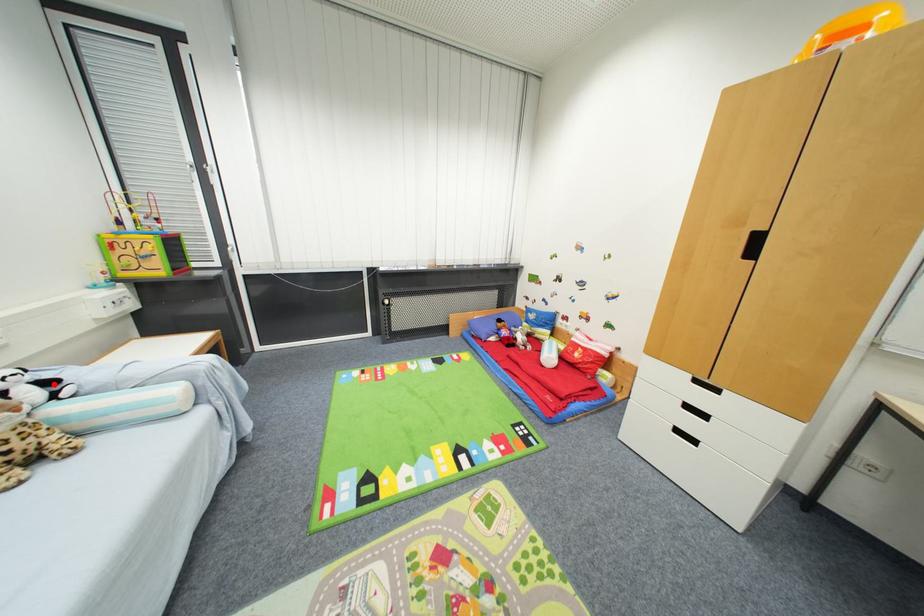
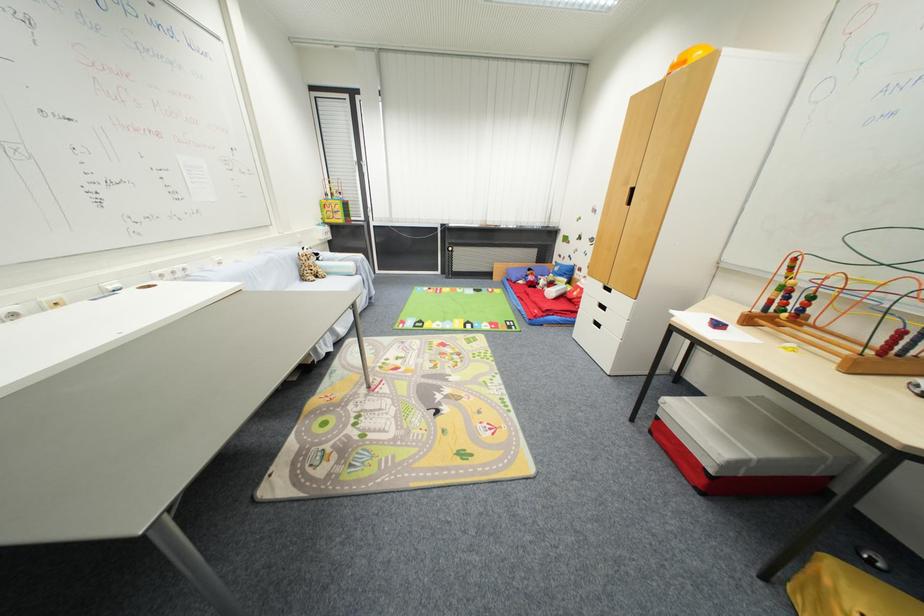
Question: I am providing you with two images of the same scene from different viewpoints. A red point is marked on the first image. Is the red point's position out of view in image 2?

Choices:
 (A) Yes
 (B) No

Answer: (A)